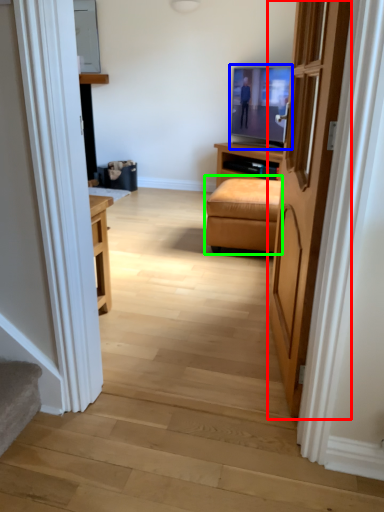
Question: Which object is the farthest from door (highlighted by a red box)? Choose among these: television (highlighted by a blue box) or studio couch (highlighted by a green box).

Choices:
 (A) television
 (B) studio couch

Answer: (A)